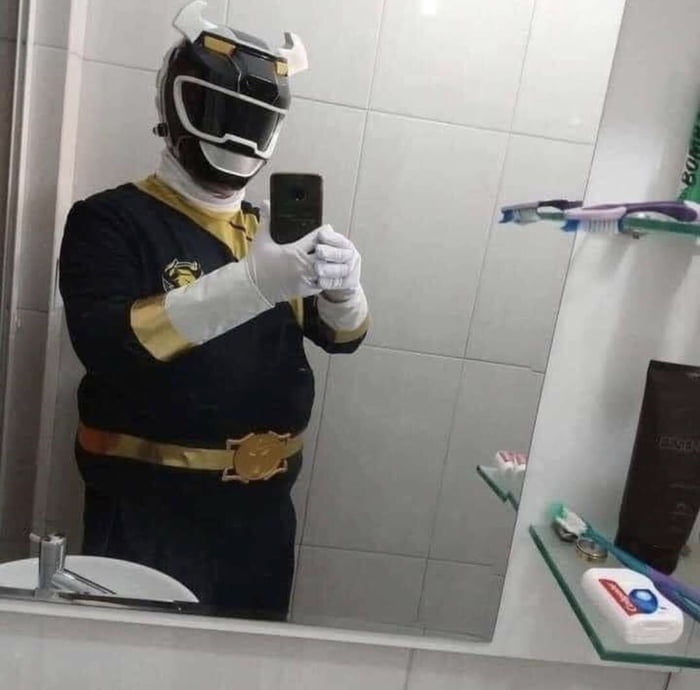
Where is `faucet reflection in mirror`? Image resolution: width=700 pixels, height=690 pixels. faucet reflection in mirror is located at coordinates (47, 568).